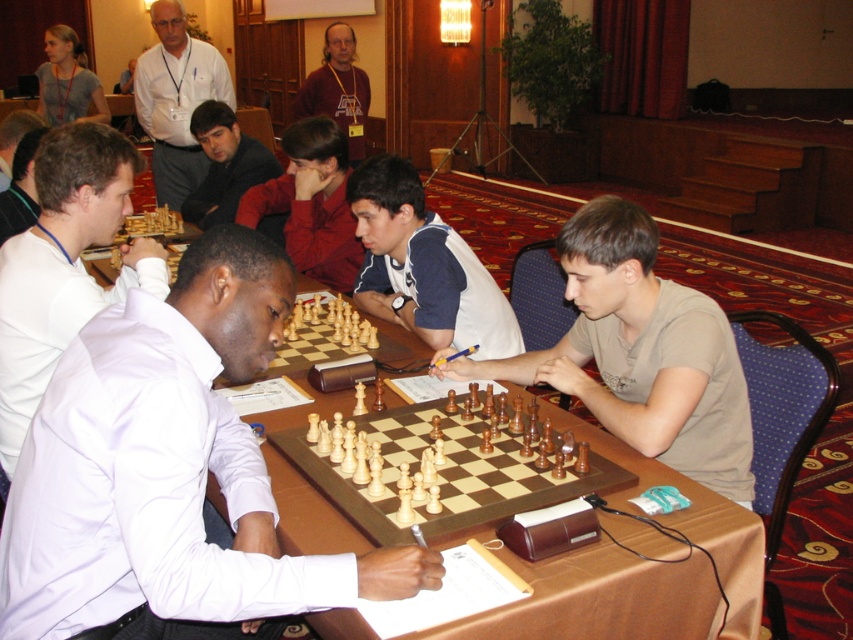
Who is positioned more to the right, white jersey at center or gray fabric shirt at upper left?

white jersey at center

Who is higher up, white jersey at center or gray fabric shirt at upper left?

gray fabric shirt at upper left is above.

Who is more forward, (367, 268) or (61, 42)?

Positioned in front is point (367, 268).

Identify the location of white jersey at center. (422, 266).

Identify the location of white jersey at center. (422, 266).

Is white jersey at center in front of white shirt at upper left?

Yes, white jersey at center is closer to the viewer.

Which is behind, point (500, 340) or point (183, 196)?

Positioned behind is point (183, 196).

You are a GUI agent. You are given a task and a screenshot of the screen. Output one action in this format:
    pyautogui.click(x=<x>, y=<y>)
    Task: Click on the white jersey at center
    The image size is (853, 640).
    Given the screenshot: What is the action you would take?
    pyautogui.click(x=422, y=266)

Based on the photo, is white jersey at center in front of dark brown hair at center?

Yes, it is.

Does white jersey at center have a lesser height compared to dark brown hair at center?

Yes.

Image resolution: width=853 pixels, height=640 pixels. Describe the element at coordinates (422, 266) in the screenshot. I see `white jersey at center` at that location.

You are a GUI agent. You are given a task and a screenshot of the screen. Output one action in this format:
    pyautogui.click(x=<x>, y=<y>)
    Task: Click on the white jersey at center
    The width and height of the screenshot is (853, 640).
    Given the screenshot: What is the action you would take?
    pyautogui.click(x=422, y=266)